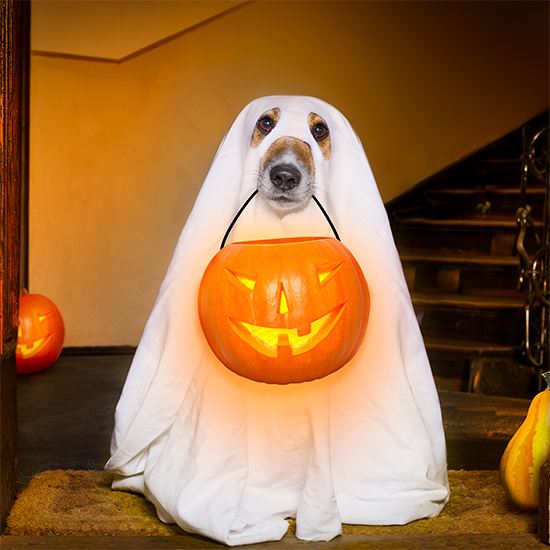
This screenshot has height=550, width=550. In order to click on wall in this screenshot , I will do `click(455, 44)`.